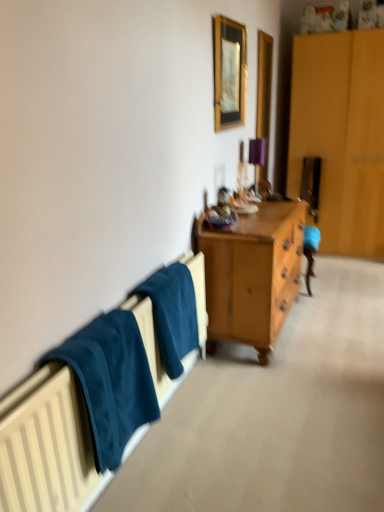
Question: Could you tell me if wooden picture frame at upper center is turned towards dark blue fabric at left?

Choices:
 (A) yes
 (B) no

Answer: (B)

Question: Can you confirm if wooden picture frame at upper center is wider than dark blue fabric at left?

Choices:
 (A) yes
 (B) no

Answer: (B)

Question: Is wooden picture frame at upper center closer to camera compared to dark blue fabric at left?

Choices:
 (A) yes
 (B) no

Answer: (B)

Question: From a real-world perspective, is wooden picture frame at upper center under dark blue fabric at left?

Choices:
 (A) no
 (B) yes

Answer: (A)

Question: From the image's perspective, does wooden picture frame at upper center appear higher than dark blue fabric at left?

Choices:
 (A) no
 (B) yes

Answer: (B)

Question: Considering the positions of dark blue fabric at left and wooden picture frame at upper center in the image, is dark blue fabric at left wider or thinner than wooden picture frame at upper center?

Choices:
 (A) wide
 (B) thin

Answer: (A)

Question: From the image's perspective, relative to wooden picture frame at upper center, is dark blue fabric at left above or below?

Choices:
 (A) above
 (B) below

Answer: (B)

Question: Is dark blue fabric at left in front of or behind wooden picture frame at upper center in the image?

Choices:
 (A) behind
 (B) front

Answer: (B)

Question: Considering the relative positions of dark blue fabric at left and wooden picture frame at upper center in the image provided, is dark blue fabric at left to the left or to the right of wooden picture frame at upper center?

Choices:
 (A) left
 (B) right

Answer: (A)

Question: Considering their positions, is wooden picture frame at upper center located in front of or behind dark blue fabric at left?

Choices:
 (A) behind
 (B) front

Answer: (A)

Question: Considering the positions of wooden picture frame at upper center and dark blue fabric at left in the image, is wooden picture frame at upper center bigger or smaller than dark blue fabric at left?

Choices:
 (A) small
 (B) big

Answer: (A)

Question: Would you say wooden picture frame at upper center is to the left or to the right of dark blue fabric at left in the picture?

Choices:
 (A) left
 (B) right

Answer: (B)

Question: From a real-world perspective, is wooden picture frame at upper center physically located above or below dark blue fabric at left?

Choices:
 (A) above
 (B) below

Answer: (A)

Question: Would you say wooden picture frame at upper center is to the left or to the right of teal fabric towel at lower left in the picture?

Choices:
 (A) left
 (B) right

Answer: (B)

Question: From their relative heights in the image, would you say wooden picture frame at upper center is taller or shorter than teal fabric towel at lower left?

Choices:
 (A) short
 (B) tall

Answer: (B)